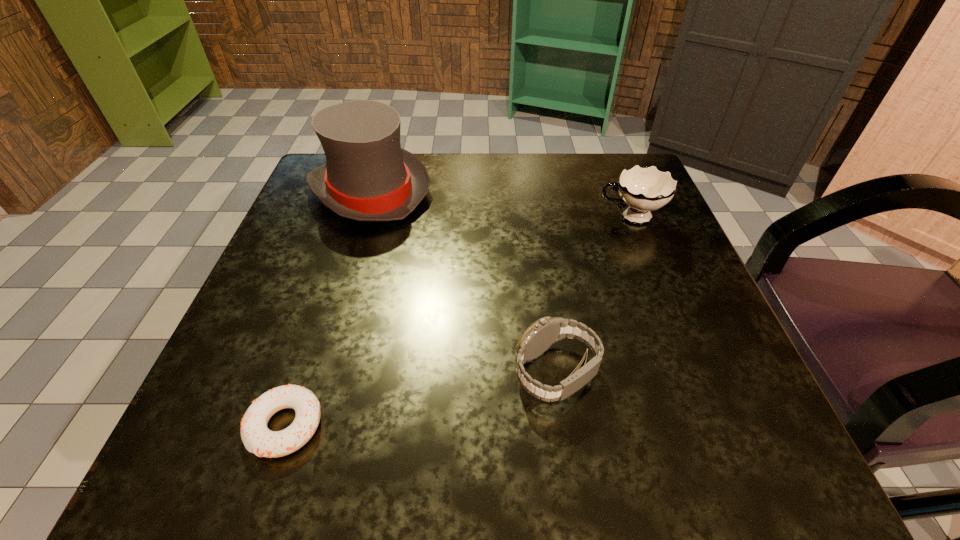
This screenshot has width=960, height=540. What are the coordinates of `blank space that satisfies the following two spatial constraints: 1. on the face of the second object from right to left; 2. on the front side of the doughnut` in the screenshot? It's located at tap(564, 426).

Identify the location of free spot that satisfies the following two spatial constraints: 1. on the side of the cup with the handle; 2. on the front side of the tallest object. The height and width of the screenshot is (540, 960). (619, 191).

Locate an element on the screen. The height and width of the screenshot is (540, 960). free location that satisfies the following two spatial constraints: 1. on the back side of the tallest object; 2. on the right side of the shortest object is located at coordinates (363, 191).